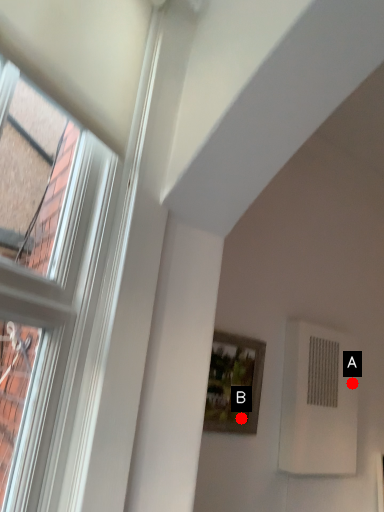
Question: Two points are circled on the image, labeled by A and B beside each circle. Which point appears farthest from the camera in this image?

Choices:
 (A) A is further
 (B) B is further

Answer: (A)